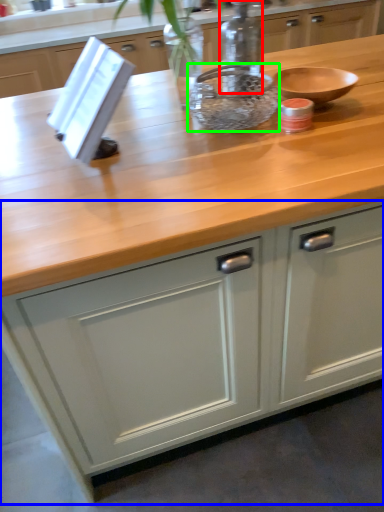
Question: Considering the real-world distances, which object is farthest from bottle (highlighted by a red box)? cabinetry (highlighted by a blue box) or bowl (highlighted by a green box)?

Choices:
 (A) cabinetry
 (B) bowl

Answer: (A)